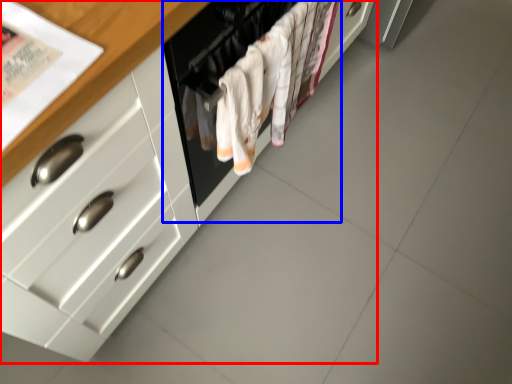
Question: Which object is closer to the camera taking this photo, cabinetry (highlighted by a red box) or oven (highlighted by a blue box)?

Choices:
 (A) cabinetry
 (B) oven

Answer: (A)